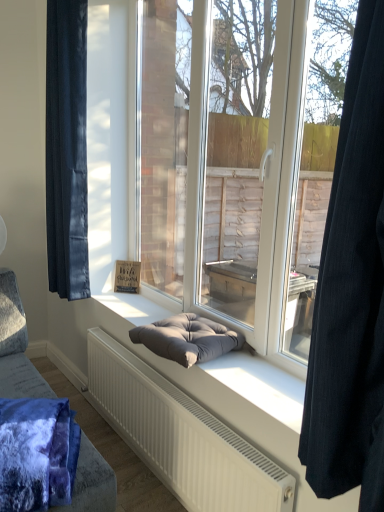
Question: Considering the relative positions of black fabric curtain at right, placed as the 1th curtain when sorted from right to left, and velvety blue blanket at lower left in the image provided, is black fabric curtain at right, placed as the 1th curtain when sorted from right to left, behind velvety blue blanket at lower left?

Choices:
 (A) yes
 (B) no

Answer: (B)

Question: From the image's perspective, is black fabric curtain at right, acting as the second curtain starting from the back, above velvety blue blanket at lower left?

Choices:
 (A) no
 (B) yes

Answer: (B)

Question: From the image's perspective, is black fabric curtain at right, arranged as the 1th curtain when viewed from the front, beneath velvety blue blanket at lower left?

Choices:
 (A) no
 (B) yes

Answer: (A)

Question: Is black fabric curtain at right, the 2th curtain viewed from the left, to the right of velvety blue blanket at lower left from the viewer's perspective?

Choices:
 (A) no
 (B) yes

Answer: (B)

Question: Is black fabric curtain at right, arranged as the 1th curtain when viewed from the front, not inside velvety blue blanket at lower left?

Choices:
 (A) no
 (B) yes

Answer: (B)

Question: Is dark gray fabric footrest at center inside or outside of velvet dark blue curtain at left, which is the second curtain from front to back?

Choices:
 (A) inside
 (B) outside

Answer: (B)

Question: Considering the relative positions of dark gray fabric footrest at center and velvet dark blue curtain at left, which appears as the 2th curtain when viewed from the right, in the image provided, is dark gray fabric footrest at center to the left or to the right of velvet dark blue curtain at left, which appears as the 2th curtain when viewed from the right,?

Choices:
 (A) left
 (B) right

Answer: (B)

Question: Does point (135, 334) appear closer or farther from the camera than point (61, 159)?

Choices:
 (A) closer
 (B) farther

Answer: (A)

Question: From the image's perspective, is dark gray fabric footrest at center above or below velvet dark blue curtain at left, arranged as the first curtain when viewed from the left?

Choices:
 (A) above
 (B) below

Answer: (B)

Question: Considering their positions, is black fabric curtain at right, placed as the 1th curtain when sorted from right to left, located in front of or behind velvet dark blue curtain at left, the first curtain when ordered from back to front?

Choices:
 (A) front
 (B) behind

Answer: (A)

Question: Based on their positions, is black fabric curtain at right, placed as the 1th curtain when sorted from right to left, located to the left or right of velvet dark blue curtain at left, which appears as the 2th curtain when viewed from the right?

Choices:
 (A) right
 (B) left

Answer: (A)

Question: Considering the positions of point (342, 415) and point (51, 269), is point (342, 415) closer or farther from the camera than point (51, 269)?

Choices:
 (A) farther
 (B) closer

Answer: (B)

Question: From the image's perspective, is black fabric curtain at right, placed as the 1th curtain when sorted from right to left, above or below velvet dark blue curtain at left, arranged as the first curtain when viewed from the left?

Choices:
 (A) above
 (B) below

Answer: (B)

Question: Relative to black fabric curtain at right, arranged as the 1th curtain when viewed from the front, is velvet dark blue curtain at left, arranged as the first curtain when viewed from the left, in front or behind?

Choices:
 (A) front
 (B) behind

Answer: (B)

Question: From the image's perspective, is velvet dark blue curtain at left, arranged as the first curtain when viewed from the left, located above or below black fabric curtain at right, placed as the 1th curtain when sorted from right to left?

Choices:
 (A) below
 (B) above

Answer: (B)